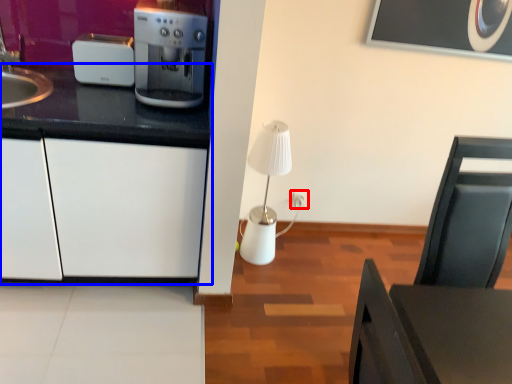
Question: Among these objects, which one is farthest to the camera, electric outlet (highlighted by a red box) or cabinetry (highlighted by a blue box)?

Choices:
 (A) electric outlet
 (B) cabinetry

Answer: (A)